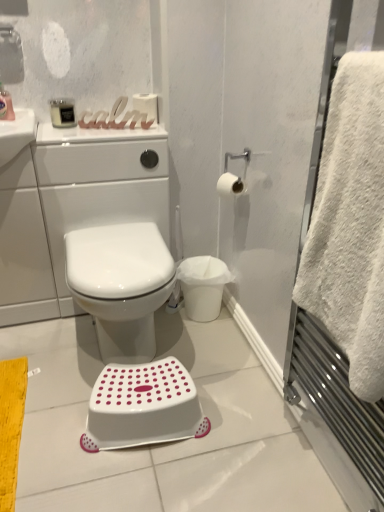
At what (x,y) coordinates should I click in order to perform the action: click on vacant area that is situated to the right of white plastic step stool at center. Please return your answer as a coordinate pair (x, y). This screenshot has width=384, height=512. Looking at the image, I should click on (246, 428).